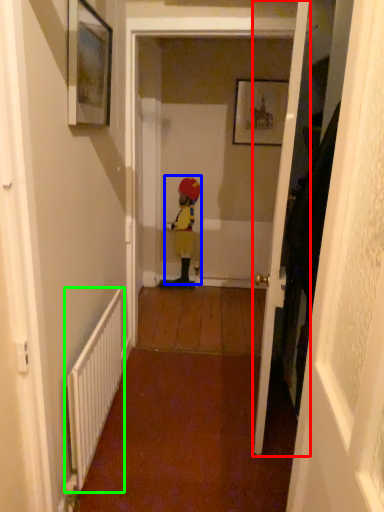
Question: Which object is positioned closest to door (highlighted by a red box)? Select from person (highlighted by a blue box) and radiator (highlighted by a green box).

Choices:
 (A) person
 (B) radiator

Answer: (B)